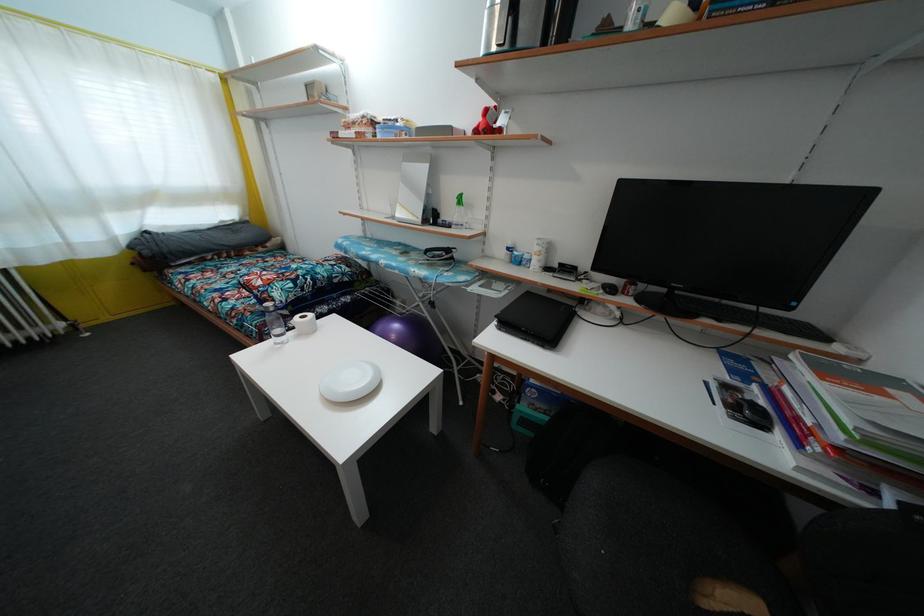
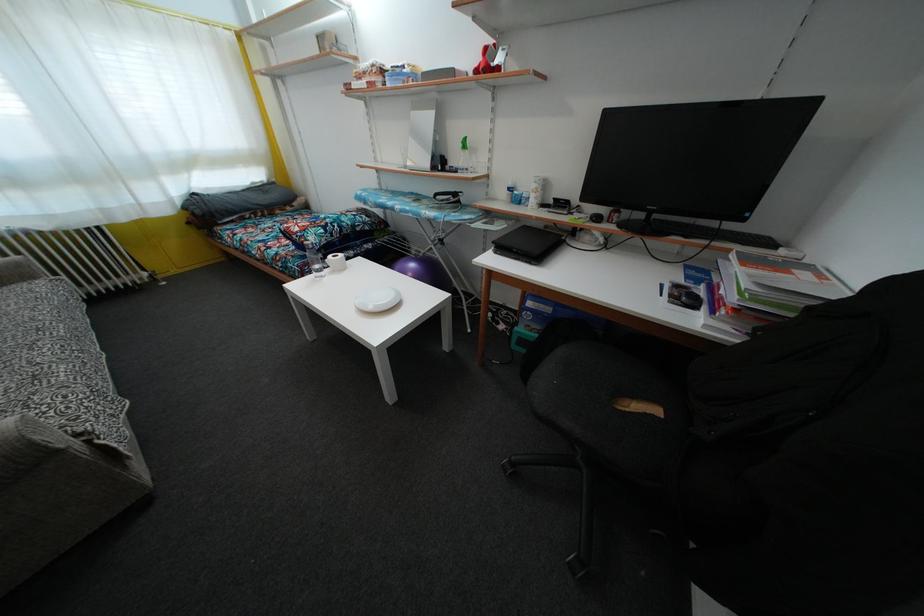
The point at (756, 314) is marked in the first image. Where is the corresponding point in the second image?

(719, 230)